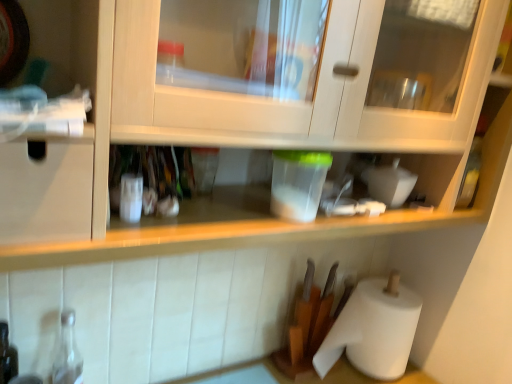
I want to click on transparent glass bottle at lower left, so click(67, 353).

This screenshot has height=384, width=512. Describe the element at coordinates (67, 353) in the screenshot. I see `transparent glass bottle at lower left` at that location.

Describe the element at coordinates (373, 330) in the screenshot. I see `white paper at lower right` at that location.

The height and width of the screenshot is (384, 512). Identify the location of white paper at lower right. (373, 330).

What are the coordinates of `transparent glass bottle at lower left` in the screenshot? It's located at (67, 353).

Would you say white paper at lower right is to the left or to the right of transparent glass bottle at lower left in the picture?

Based on their positions, white paper at lower right is located to the right of transparent glass bottle at lower left.

Considering their positions, is white paper at lower right located in front of or behind transparent glass bottle at lower left?

In the image, white paper at lower right appears behind transparent glass bottle at lower left.

In the scene shown: Which is closer to the camera, (397,332) or (71,329)?

The point (71,329) is more forward.

From the image's perspective, would you say white paper at lower right is shown under transparent glass bottle at lower left?

No, from the image's perspective, white paper at lower right is not beneath transparent glass bottle at lower left.

In the scene shown: From a real-world perspective, relative to transparent glass bottle at lower left, is white paper at lower right vertically above or below?

white paper at lower right is situated higher than transparent glass bottle at lower left in the real world.

In terms of width, does white paper at lower right look wider or thinner when compared to transparent glass bottle at lower left?

Considering their sizes, white paper at lower right looks broader than transparent glass bottle at lower left.

Considering the sizes of objects white paper at lower right and transparent glass bottle at lower left in the image provided, who is taller, white paper at lower right or transparent glass bottle at lower left?

white paper at lower right.

Is white paper at lower right bigger than transparent glass bottle at lower left?

Correct, white paper at lower right is larger in size than transparent glass bottle at lower left.

Can transparent glass bottle at lower left be found inside white paper at lower right?

No, transparent glass bottle at lower left is not a part of white paper at lower right.

Does white paper at lower right touch transparent glass bottle at lower left?

They are not placed beside each other.

Does white paper at lower right turn towards transparent glass bottle at lower left?

No, white paper at lower right is not turned towards transparent glass bottle at lower left.

Where is `paper towel on the right of transparent glass bottle at lower left`? Image resolution: width=512 pixels, height=384 pixels. paper towel on the right of transparent glass bottle at lower left is located at coordinates (373, 330).

Which object is positioned more to the right, transparent glass bottle at lower left or white paper at lower right?

white paper at lower right is more to the right.

Between transparent glass bottle at lower left and white paper at lower right, which one is positioned in front?

transparent glass bottle at lower left is in front.

Consider the image. Which point is more distant from viewer, (74,378) or (409,310)?

Positioned behind is point (409,310).

From the image's perspective, is transparent glass bottle at lower left below white paper at lower right?

Correct, transparent glass bottle at lower left appears lower than white paper at lower right in the image.

From a real-world perspective, is transparent glass bottle at lower left positioned above or below white paper at lower right?

transparent glass bottle at lower left is below white paper at lower right.

Which object is wider, transparent glass bottle at lower left or white paper at lower right?

white paper at lower right is wider.

Can you confirm if transparent glass bottle at lower left is taller than white paper at lower right?

No, transparent glass bottle at lower left is not taller than white paper at lower right.

Who is smaller, transparent glass bottle at lower left or white paper at lower right?

transparent glass bottle at lower left.

Which is correct: transparent glass bottle at lower left is inside white paper at lower right, or outside of it?

transparent glass bottle at lower left is spatially situated outside white paper at lower right.

In the scene shown: Is transparent glass bottle at lower left positioned far away from white paper at lower right?

They are positioned close to each other.

Is white paper at lower right at the back of transparent glass bottle at lower left?

transparent glass bottle at lower left is not turned away from white paper at lower right.

Measure the distance from transparent glass bottle at lower left to white paper at lower right.

transparent glass bottle at lower left and white paper at lower right are 77.34 centimeters apart from each other.

You are a GUI agent. You are given a task and a screenshot of the screen. Output one action in this format:
    pyautogui.click(x=<x>, y=<y>)
    Task: Click on the paper towel located above the transparent glass bottle at lower left (from the image's perspective)
    Image resolution: width=512 pixels, height=384 pixels.
    Given the screenshot: What is the action you would take?
    pyautogui.click(x=373, y=330)

Find the location of a particular element. bottle in front of the white paper at lower right is located at coordinates (67, 353).

Find the location of a particular element. bottle beneath the white paper at lower right (from a real-world perspective) is located at coordinates (67, 353).